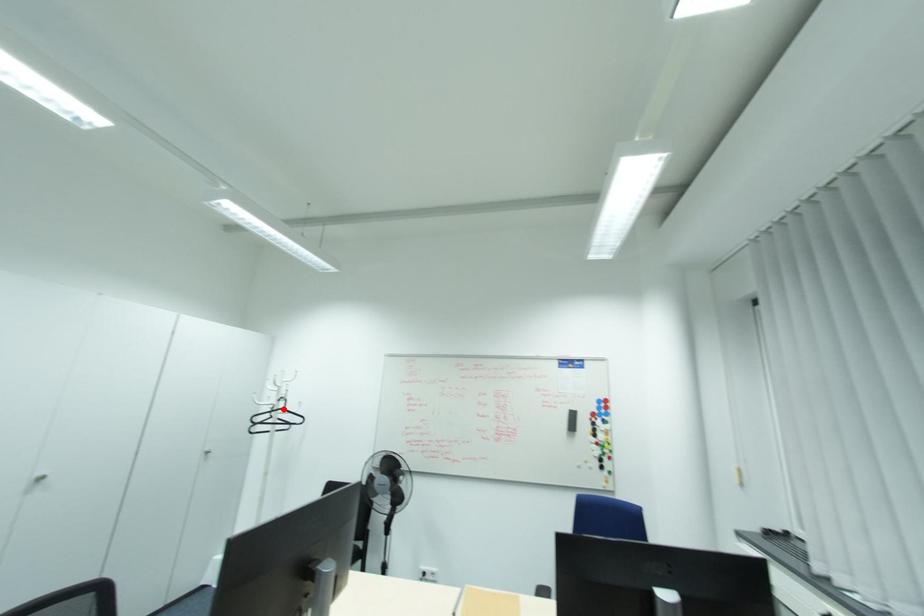
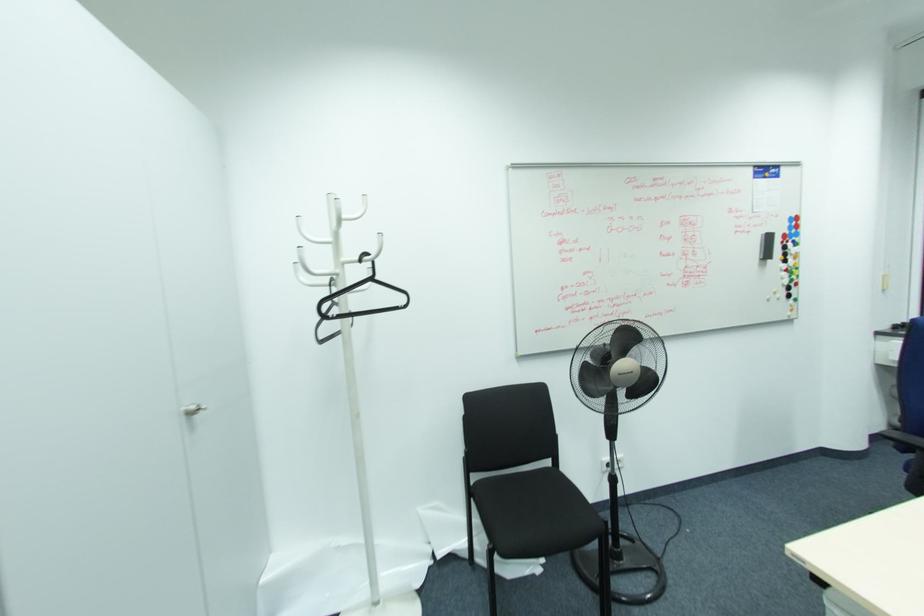
The point at the highlighted location is marked in the first image. Where is the corresponding point in the second image?

(371, 280)